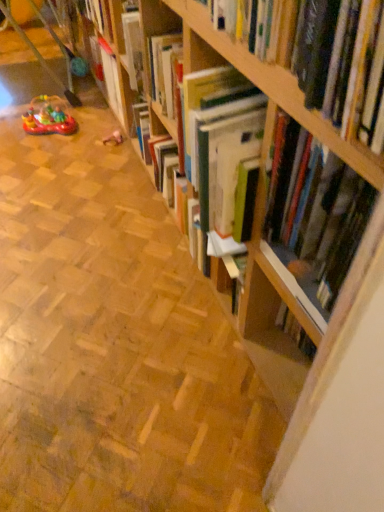
Identify the location of free spot behind wooden bookcase at upper right. Image resolution: width=384 pixels, height=512 pixels. (188, 418).